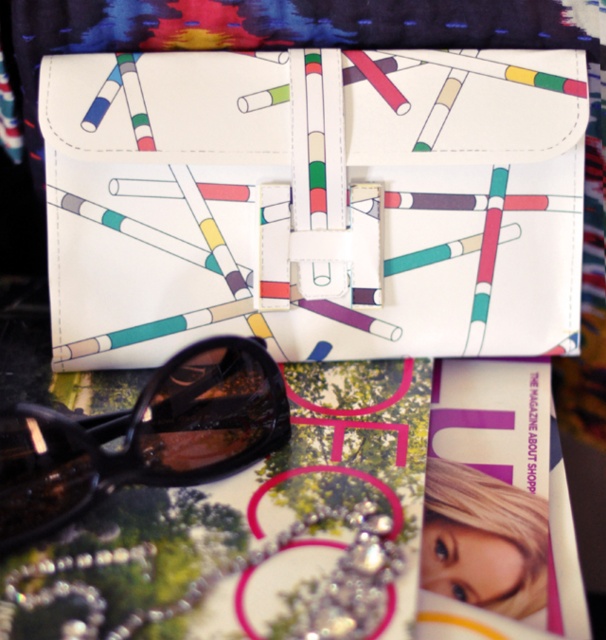
You are standing in front of a table with a colorful background. There is a white leather clutch at center. Where exactly is the white leather clutch located on the table?

The white leather clutch at center is located at the coordinates point (315,204).

You are standing 4 feet away from the camera. Can you reach the white leather clutch at center without moving your feet?

The white leather clutch at center is 3.82 feet away from the camera. Since you are 4 feet away from the camera, you are slightly farther than the clutch. You might need to stretch or move closer to reach it.

You are organizing a small display on a shelf. The shelf has limited vertical space. You need to place both the white leather clutch at center and the black shiny goggles at lower left. Which item should you place first to ensure both fit vertically?

The white leather clutch at center has a greater height compared to the black shiny goggles at lower left. Therefore, you should place the white leather clutch at center first to ensure there is enough vertical space for both items.